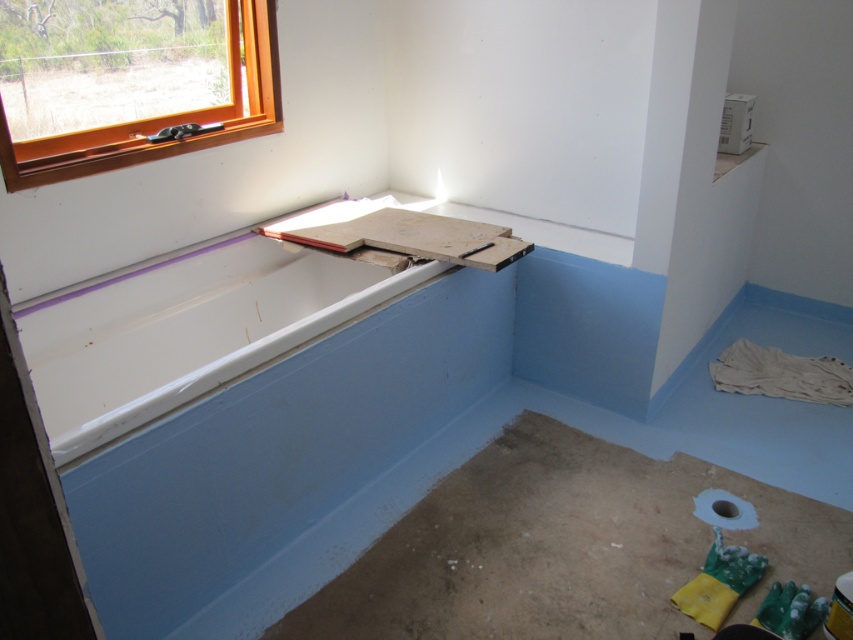
Question: Is white glossy bathtub at upper left smaller than orange wood window at upper left?

Choices:
 (A) yes
 (B) no

Answer: (B)

Question: Is white glossy bathtub at upper left below orange wood window at upper left?

Choices:
 (A) no
 (B) yes

Answer: (B)

Question: In this image, where is white glossy bathtub at upper left located relative to orange wood window at upper left?

Choices:
 (A) right
 (B) left

Answer: (A)

Question: Which of the following is the farthest from the observer?

Choices:
 (A) white glossy bathtub at upper left
 (B) orange wood window at upper left

Answer: (A)